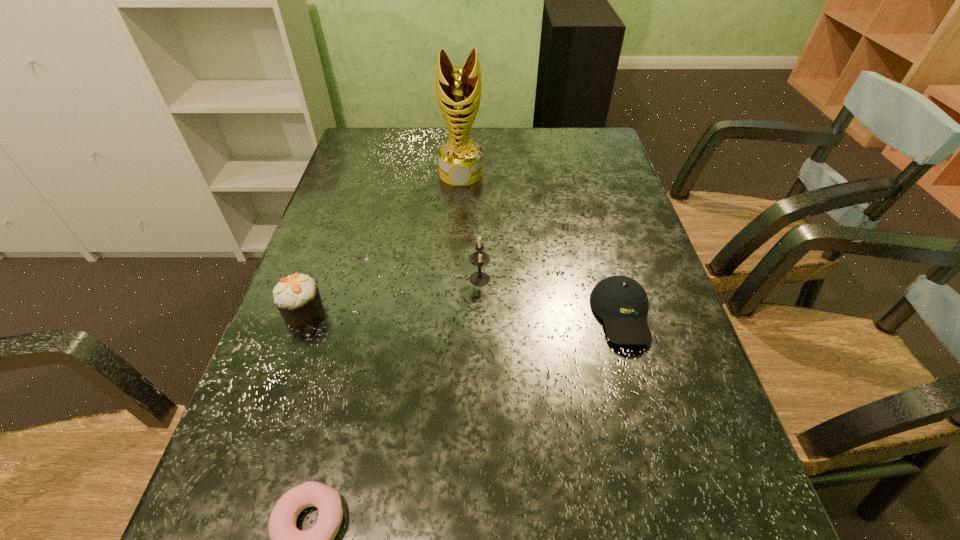
At what (x,y) coordinates should I click in order to perform the action: click on award. Please return your answer as a coordinate pair (x, y). Looking at the image, I should click on (458, 89).

Image resolution: width=960 pixels, height=540 pixels. Find the location of `the farthest object`. the farthest object is located at coordinates tap(458, 89).

What are the coordinates of `the second tallest object` in the screenshot? It's located at coord(480,259).

I want to click on cupcake, so click(x=297, y=297).

You are a GUI agent. You are given a task and a screenshot of the screen. Output one action in this format:
    pyautogui.click(x=<x>, y=<y>)
    Task: Click on the third shortest object
    
    Given the screenshot: What is the action you would take?
    pyautogui.click(x=297, y=297)

This screenshot has height=540, width=960. Identify the location of baseball cap. click(621, 302).

The width and height of the screenshot is (960, 540). I want to click on the rightmost object, so click(621, 302).

I want to click on vacant space located on the front-facing side of the tallest object, so click(456, 259).

Locate an element on the screen. The width and height of the screenshot is (960, 540). vacant space located 0.140m on the left of the candle holder is located at coordinates (408, 279).

The image size is (960, 540). What are the coordinates of `vacant space positioned on the right of the cupcake` in the screenshot? It's located at (464, 311).